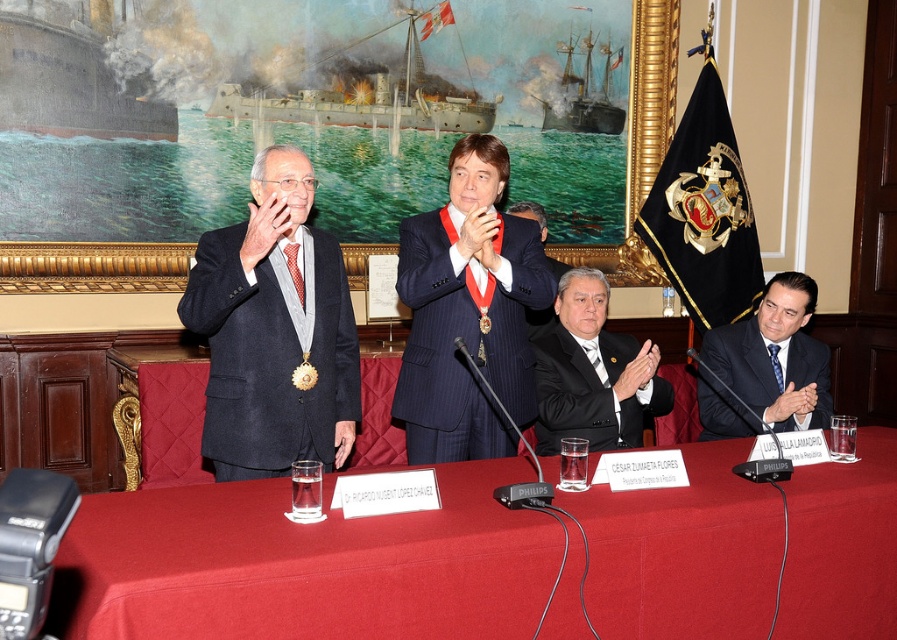
Is smooth red tablecloth at center positioned in front of black satin suit at center?

Yes, it is in front of black satin suit at center.

Is smooth red tablecloth at center to the right of black satin suit at center from the viewer's perspective?

In fact, smooth red tablecloth at center is to the left of black satin suit at center.

Is point (440, 616) closer to viewer compared to point (562, 276)?

Yes, point (440, 616) is in front of point (562, 276).

You are a GUI agent. You are given a task and a screenshot of the screen. Output one action in this format:
    pyautogui.click(x=<x>, y=<y>)
    Task: Click on the smooth red tablecloth at center
    The height and width of the screenshot is (640, 897).
    Given the screenshot: What is the action you would take?
    pyautogui.click(x=303, y=564)

This screenshot has width=897, height=640. Describe the element at coordinates (593, 372) in the screenshot. I see `black satin suit at center` at that location.

Is black satin suit at center to the left of red silk tie at center from the viewer's perspective?

Incorrect, black satin suit at center is not on the left side of red silk tie at center.

Identify the location of black satin suit at center. (593, 372).

Is point (451, 300) positioned after point (777, 339)?

No, (451, 300) is closer to viewer.

Which is behind, point (425, 426) or point (800, 380)?

Point (800, 380)

Is point (475, 328) in front of point (798, 280)?

Yes, point (475, 328) is closer to viewer.

At what (x,y) coordinates should I click in order to perform the action: click on pinstripe suit at center. Please return your answer as a coordinate pair (x, y). This screenshot has height=640, width=897. Looking at the image, I should click on (468, 312).